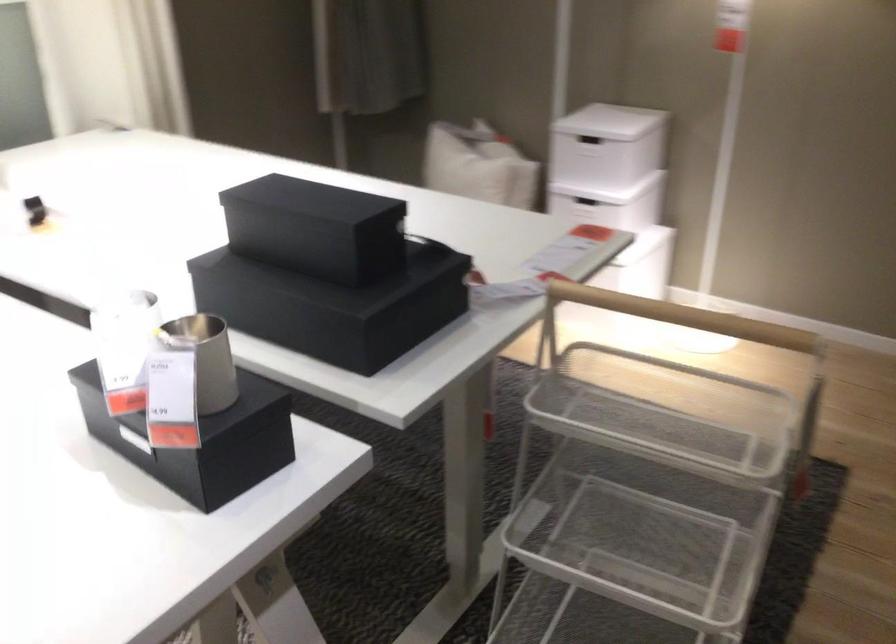
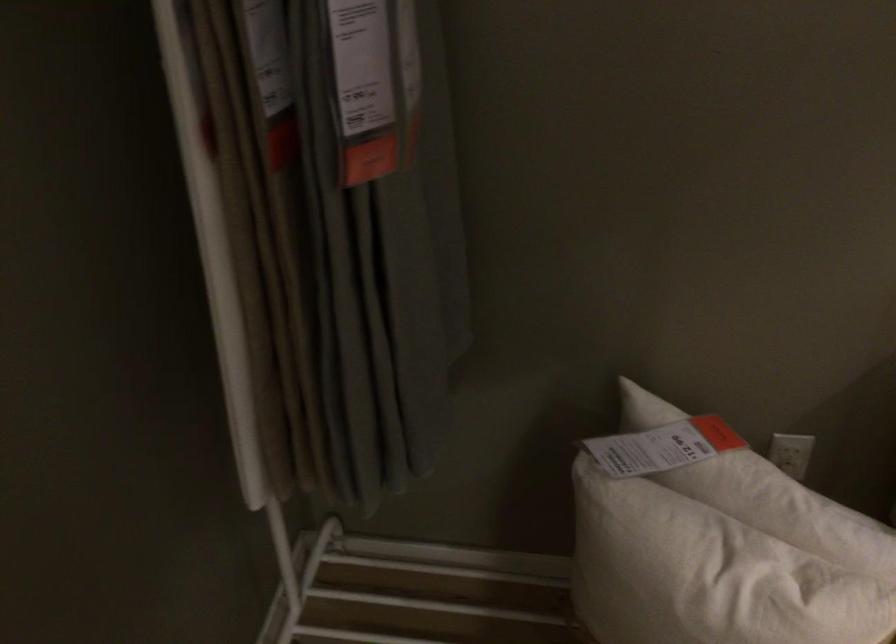
Question: Which direction would the cameraman need to move to produce the second image? Reply with the corresponding letter.

Choices:
 (A) Left
 (B) Right
 (C) Forward
 (D) Backward

Answer: (C)